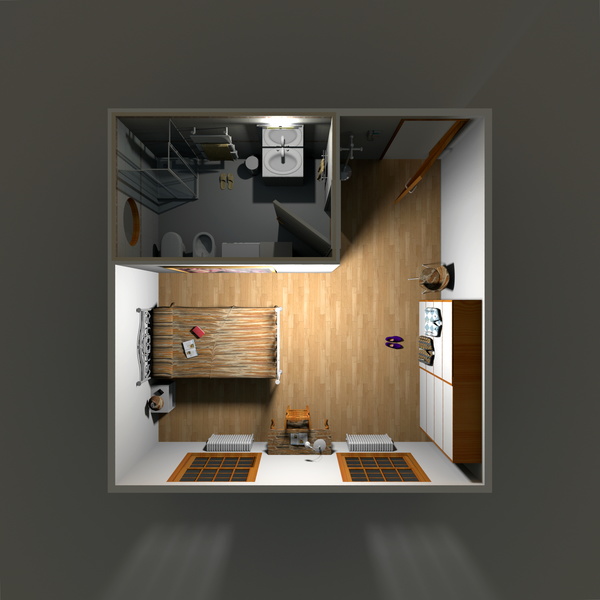
You are a GUI agent. You are given a task and a screenshot of the screen. Output one action in this format:
    pyautogui.click(x=<x>, y=<y>)
    Task: Click on the wooden floor
    This screenshot has height=600, width=600.
    Given the screenshot: What is the action you would take?
    pyautogui.click(x=377, y=396), pyautogui.click(x=344, y=337), pyautogui.click(x=402, y=195), pyautogui.click(x=364, y=262)